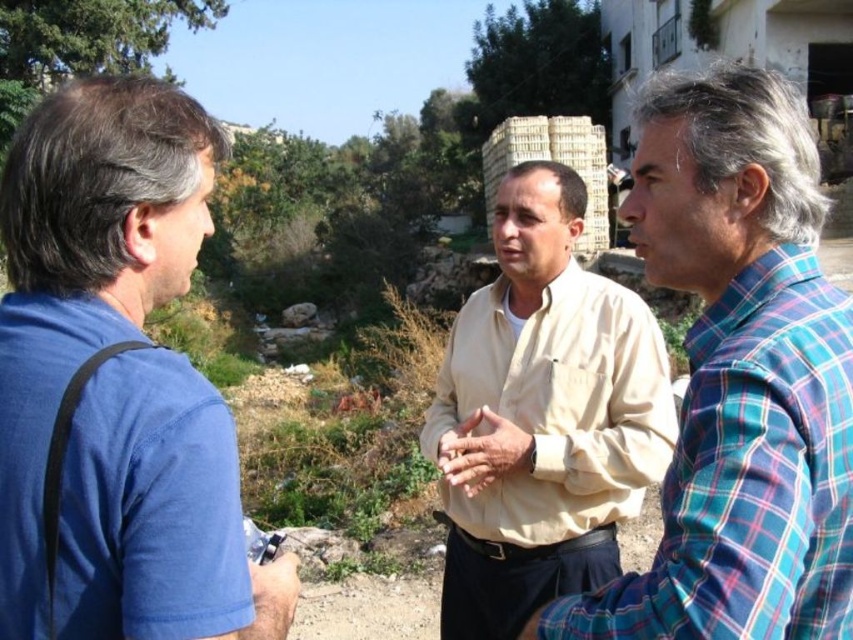
Question: In this image, where is plaid cotton shirt at center located relative to beige cotton shirt at center?

Choices:
 (A) right
 (B) left

Answer: (A)

Question: Which object appears closest to the camera in this image?

Choices:
 (A) beige cotton shirt at center
 (B) plaid cotton shirt at center

Answer: (B)

Question: Is plaid cotton shirt at center further to the viewer compared to beige cotton shirt at center?

Choices:
 (A) no
 (B) yes

Answer: (A)

Question: Does blue cotton shirt at left appear on the right side of beige cotton shirt at center?

Choices:
 (A) no
 (B) yes

Answer: (A)

Question: Based on their relative distances, which object is nearer to the beige cotton shirt at center?

Choices:
 (A) plaid cotton shirt at center
 (B) blue cotton shirt at left

Answer: (A)

Question: Among these points, which one is farthest from the camera?

Choices:
 (A) (772, 486)
 (B) (575, 420)
 (C) (271, 621)

Answer: (B)